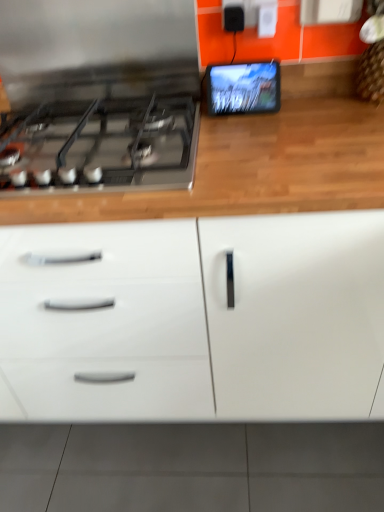
Question: Considering the relative sizes of white glossy cabinet at center and satin black gas stove at left in the image provided, is white glossy cabinet at center wider than satin black gas stove at left?

Choices:
 (A) yes
 (B) no

Answer: (A)

Question: Considering the relative sizes of white glossy cabinet at center and satin black gas stove at left in the image provided, is white glossy cabinet at center taller than satin black gas stove at left?

Choices:
 (A) yes
 (B) no

Answer: (A)

Question: Are white glossy cabinet at center and satin black gas stove at left making contact?

Choices:
 (A) yes
 (B) no

Answer: (B)

Question: Considering the relative positions of white glossy cabinet at center and satin black gas stove at left in the image provided, is white glossy cabinet at center to the left of satin black gas stove at left from the viewer's perspective?

Choices:
 (A) no
 (B) yes

Answer: (A)

Question: Is white glossy cabinet at center bigger than satin black gas stove at left?

Choices:
 (A) yes
 (B) no

Answer: (A)

Question: Considering the positions of matte black tablet at upper right and white glossy cabinet at center in the image, is matte black tablet at upper right bigger or smaller than white glossy cabinet at center?

Choices:
 (A) big
 (B) small

Answer: (B)

Question: Is matte black tablet at upper right wider or thinner than white glossy cabinet at center?

Choices:
 (A) wide
 (B) thin

Answer: (B)

Question: From their relative heights in the image, would you say matte black tablet at upper right is taller or shorter than white glossy cabinet at center?

Choices:
 (A) short
 (B) tall

Answer: (A)

Question: Visually, is matte black tablet at upper right positioned to the left or to the right of white glossy cabinet at center?

Choices:
 (A) right
 (B) left

Answer: (A)

Question: Would you say white glossy cabinet at center is inside or outside satin black gas stove at left?

Choices:
 (A) outside
 (B) inside

Answer: (A)

Question: Considering the positions of white glossy cabinet at center and satin black gas stove at left in the image, is white glossy cabinet at center bigger or smaller than satin black gas stove at left?

Choices:
 (A) small
 (B) big

Answer: (B)

Question: In terms of height, does white glossy cabinet at center look taller or shorter compared to satin black gas stove at left?

Choices:
 (A) tall
 (B) short

Answer: (A)

Question: Considering their positions, is white glossy cabinet at center located in front of or behind satin black gas stove at left?

Choices:
 (A) front
 (B) behind

Answer: (A)

Question: Relative to matte black tablet at upper right, is white glossy cabinet at center in front or behind?

Choices:
 (A) front
 (B) behind

Answer: (A)

Question: Is white glossy cabinet at center inside the boundaries of matte black tablet at upper right, or outside?

Choices:
 (A) inside
 (B) outside

Answer: (B)